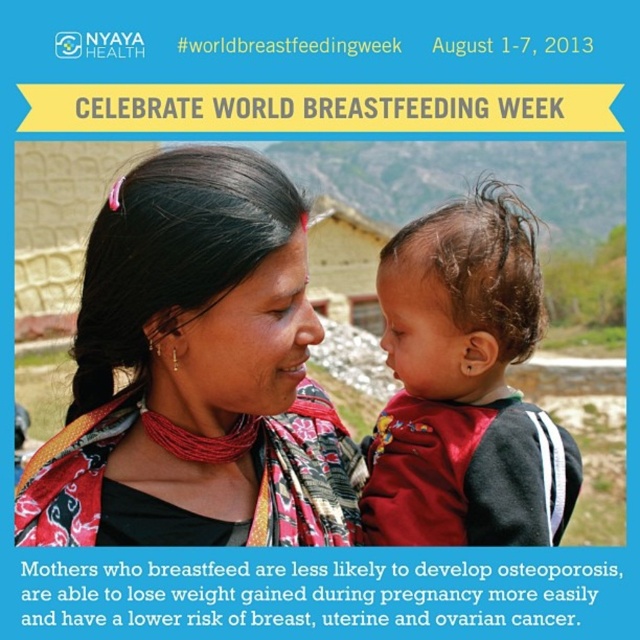
Is multicolored fabric scarf at center taller than curly brown hair at center?

No.

Where is `multicolored fabric scarf at center`? Image resolution: width=640 pixels, height=640 pixels. multicolored fabric scarf at center is located at coordinates (195, 372).